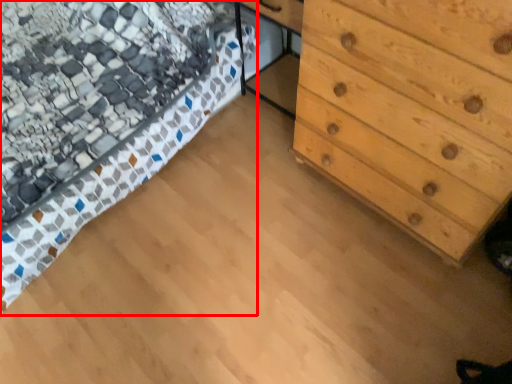
Question: From the image's perspective, considering the relative positions of bed (annotated by the red box) and chest of drawers in the image provided, where is bed (annotated by the red box) located with respect to the staircase?

Choices:
 (A) below
 (B) above

Answer: (B)